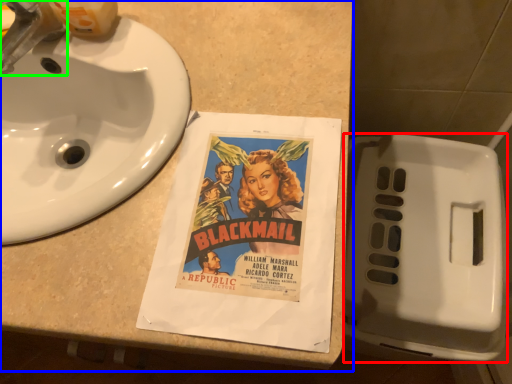
Question: Which object is the farthest from toilet (highlighted by a red box)? Choose among these: counter top (highlighted by a blue box) or faucet (highlighted by a green box).

Choices:
 (A) counter top
 (B) faucet

Answer: (B)